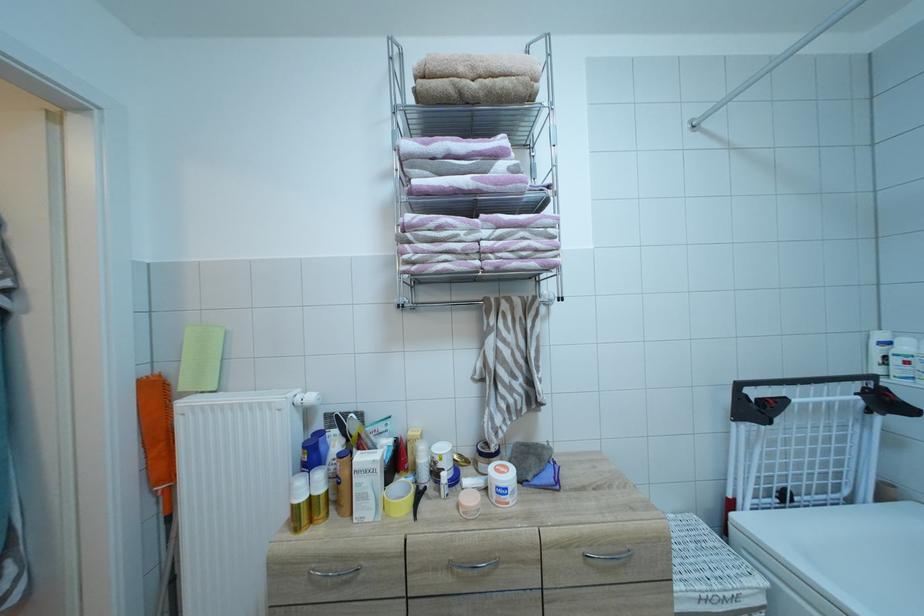
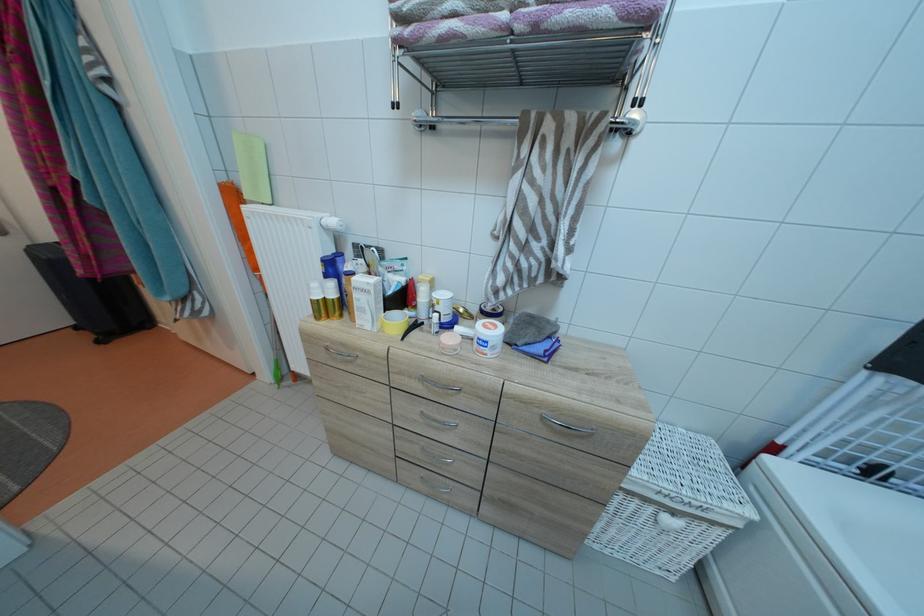
Where in the second image is the point corresponding to point 318,403 from the first image?

(341, 227)